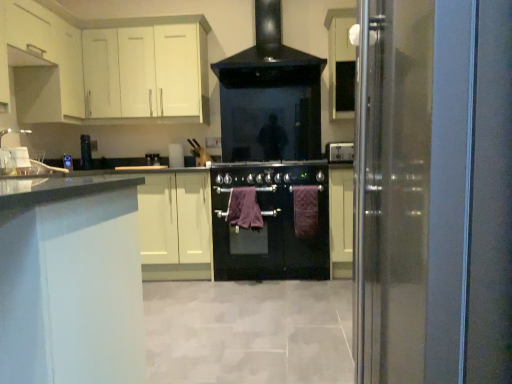
Question: Considering the relative positions of white matte cabinet at upper left, the first cabinetry in the left-to-right sequence, and purple cotton towel at center, which is counted as the first blanket, starting from the left, in the image provided, is white matte cabinet at upper left, the first cabinetry in the left-to-right sequence, to the right of purple cotton towel at center, which is counted as the first blanket, starting from the left, from the viewer's perspective?

Choices:
 (A) yes
 (B) no

Answer: (B)

Question: From the image's perspective, is white matte cabinet at upper left, which is the second cabinetry in back-to-front order, above purple cotton towel at center, which is counted as the first blanket, starting from the left?

Choices:
 (A) no
 (B) yes

Answer: (B)

Question: Is white matte cabinet at upper left, which is the second cabinetry in right-to-left order, behind purple cotton towel at center, the second blanket positioned from the right?

Choices:
 (A) yes
 (B) no

Answer: (B)

Question: Are white matte cabinet at upper left, arranged as the first cabinetry when viewed from the front, and purple cotton towel at center, which is counted as the first blanket, starting from the left, beside each other?

Choices:
 (A) yes
 (B) no

Answer: (B)

Question: Can you confirm if white matte cabinet at upper left, arranged as the first cabinetry when viewed from the front, is smaller than purple cotton towel at center, which is counted as the first blanket, starting from the left?

Choices:
 (A) no
 (B) yes

Answer: (A)

Question: Is white matte cabinet at upper left, which is the second cabinetry in right-to-left order, outside of purple cotton towel at center, which is counted as the first blanket, starting from the left?

Choices:
 (A) no
 (B) yes

Answer: (B)

Question: Considering the relative positions of white matte cabinet at upper left, which appears as the second cabinetry when viewed from the front, and transparent glass door at right in the image provided, is white matte cabinet at upper left, which appears as the second cabinetry when viewed from the front, behind transparent glass door at right?

Choices:
 (A) no
 (B) yes

Answer: (B)

Question: From a real-world perspective, is white matte cabinet at upper left, which ranks as the 2th cabinetry in left-to-right order, located higher than transparent glass door at right?

Choices:
 (A) yes
 (B) no

Answer: (A)

Question: Can you confirm if white matte cabinet at upper left, acting as the first cabinetry starting from the back, is bigger than transparent glass door at right?

Choices:
 (A) yes
 (B) no

Answer: (B)

Question: Can transparent glass door at right be found inside white matte cabinet at upper left, which appears as the second cabinetry when viewed from the front?

Choices:
 (A) no
 (B) yes

Answer: (A)

Question: From the image's perspective, is white matte cabinet at upper left, which is counted as the first cabinetry, starting from the right, beneath transparent glass door at right?

Choices:
 (A) no
 (B) yes

Answer: (A)

Question: Considering the relative positions of white matte cabinet at upper left, which is counted as the first cabinetry, starting from the right, and transparent glass door at right in the image provided, is white matte cabinet at upper left, which is counted as the first cabinetry, starting from the right, to the left of transparent glass door at right from the viewer's perspective?

Choices:
 (A) no
 (B) yes

Answer: (B)

Question: Can you confirm if satin silver power outlet at upper right, acting as the first appliance starting from the front, is taller than white matte cabinet at upper left, the first cabinetry in the left-to-right sequence?

Choices:
 (A) no
 (B) yes

Answer: (A)